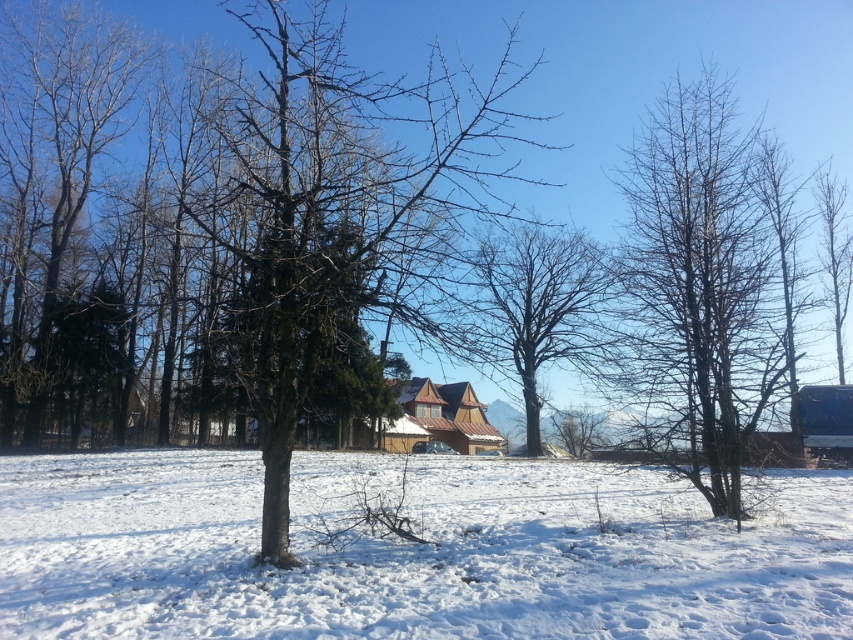
Question: Considering the real-world distances, which object is closest to the bare branches at center?

Choices:
 (A) brown rough bark tree at center
 (B) white fluffy snow at center
 (C) bare wood tree at left

Answer: (B)

Question: Which point is closer to the camera taking this photo?

Choices:
 (A) (431, 72)
 (B) (688, 349)
 (C) (107, 44)
 (D) (770, 612)

Answer: (D)

Question: Can you confirm if brown rough bark tree at center is bigger than bare branches at center?

Choices:
 (A) yes
 (B) no

Answer: (A)

Question: Which of the following is the farthest from the observer?

Choices:
 (A) white fluffy snow at center
 (B) brown rough bark tree at center
 (C) bare branches at center
 (D) bare wood tree at left

Answer: (D)

Question: Where is brown rough bark tree at center located in relation to bare branches at center in the image?

Choices:
 (A) above
 (B) below

Answer: (A)

Question: In this image, where is white fluffy snow at center located relative to bare branches at center?

Choices:
 (A) left
 (B) right

Answer: (A)